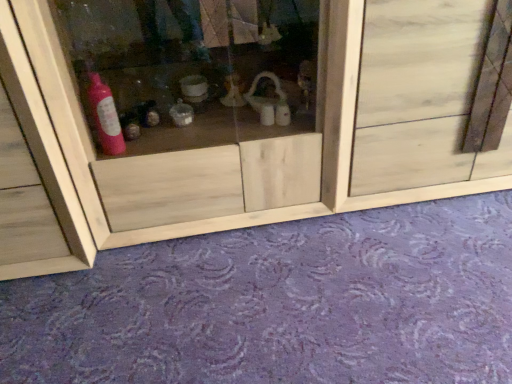
Question: Is purple carpet at lower center placed right next to transparent wood cabinet at center?

Choices:
 (A) no
 (B) yes

Answer: (A)

Question: Is purple carpet at lower center taller than transparent wood cabinet at center?

Choices:
 (A) no
 (B) yes

Answer: (A)

Question: Could you tell me if purple carpet at lower center is facing transparent wood cabinet at center?

Choices:
 (A) yes
 (B) no

Answer: (B)

Question: Is purple carpet at lower center oriented away from transparent wood cabinet at center?

Choices:
 (A) no
 (B) yes

Answer: (A)

Question: Can you confirm if purple carpet at lower center is smaller than transparent wood cabinet at center?

Choices:
 (A) no
 (B) yes

Answer: (B)

Question: From a real-world perspective, is purple carpet at lower center on transparent wood cabinet at center?

Choices:
 (A) yes
 (B) no

Answer: (B)

Question: Are transparent wood cabinet at center and natural wood door at center located far from each other?

Choices:
 (A) yes
 (B) no

Answer: (B)

Question: Does transparent wood cabinet at center lie behind natural wood door at center?

Choices:
 (A) no
 (B) yes

Answer: (A)

Question: Can you confirm if transparent wood cabinet at center is bigger than natural wood door at center?

Choices:
 (A) yes
 (B) no

Answer: (A)

Question: Is natural wood door at center located within transparent wood cabinet at center?

Choices:
 (A) no
 (B) yes

Answer: (A)

Question: From the image's perspective, is transparent wood cabinet at center on natural wood door at center?

Choices:
 (A) no
 (B) yes

Answer: (A)

Question: From the image's perspective, is transparent wood cabinet at center beneath natural wood door at center?

Choices:
 (A) yes
 (B) no

Answer: (A)

Question: From the image's perspective, is transparent wood cabinet at center under purple carpet at lower center?

Choices:
 (A) no
 (B) yes

Answer: (A)